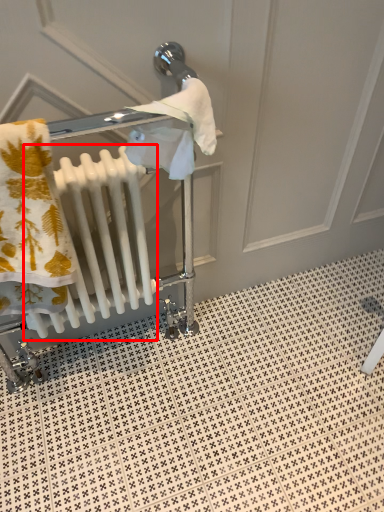
Question: From the image's perspective, what is the correct spatial relationship of radiator (annotated by the red box) in relation to tile?

Choices:
 (A) below
 (B) above

Answer: (B)